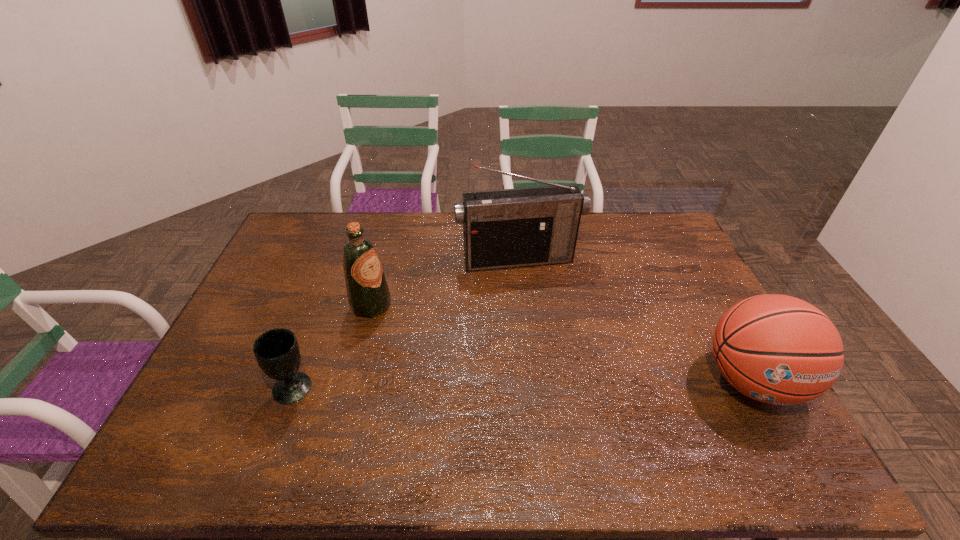
You are a GUI agent. You are given a task and a screenshot of the screen. Output one action in this format:
    pyautogui.click(x=<x>, y=<y>)
    Task: Click on the shortest object
    
    Given the screenshot: What is the action you would take?
    pyautogui.click(x=277, y=352)

This screenshot has width=960, height=540. Find the location of `the leftmost object`. the leftmost object is located at coordinates (277, 352).

The height and width of the screenshot is (540, 960). In order to click on the rightmost object in this screenshot , I will do `click(777, 349)`.

This screenshot has width=960, height=540. What are the coordinates of `olive oil` in the screenshot? It's located at (368, 294).

Locate an element on the screen. The height and width of the screenshot is (540, 960). the second farthest object is located at coordinates (368, 294).

Image resolution: width=960 pixels, height=540 pixels. Identify the location of the farthest object. (506, 228).

Identify the location of the third object from left to right. pyautogui.click(x=506, y=228).

I want to click on vacant space located on the back of the chalice, so click(327, 294).

Find the location of `free space located 0.170m on the front-facing side of the second object from left to right`. free space located 0.170m on the front-facing side of the second object from left to right is located at coordinates (430, 336).

Locate an element on the screen. free space located on the front-facing side of the second object from left to right is located at coordinates (468, 356).